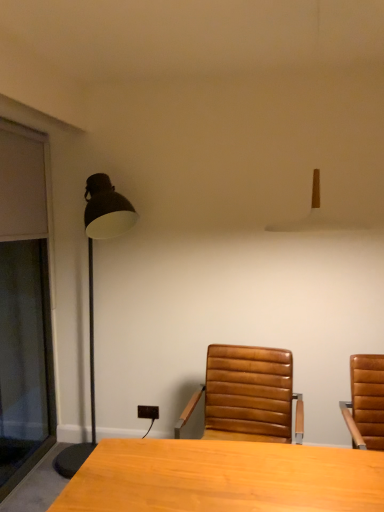
Question: Considering the relative sizes of leather at center and transparent glass screen door at left in the image provided, is leather at center smaller than transparent glass screen door at left?

Choices:
 (A) no
 (B) yes

Answer: (A)

Question: Is leather at center to the left of transparent glass screen door at left from the viewer's perspective?

Choices:
 (A) no
 (B) yes

Answer: (A)

Question: Is leather at center at the right side of transparent glass screen door at left?

Choices:
 (A) yes
 (B) no

Answer: (A)

Question: Is leather at center behind transparent glass screen door at left?

Choices:
 (A) yes
 (B) no

Answer: (B)

Question: Is leather at center closer to camera compared to transparent glass screen door at left?

Choices:
 (A) no
 (B) yes

Answer: (B)

Question: Considering the positions of point (39, 187) and point (91, 258), is point (39, 187) closer or farther from the camera than point (91, 258)?

Choices:
 (A) closer
 (B) farther

Answer: (A)

Question: Is transparent glass screen door at left wider or thinner than matte black floor lamp at left, acting as the 2th lamp starting from the front?

Choices:
 (A) thin
 (B) wide

Answer: (A)

Question: Considering the positions of transparent glass screen door at left and matte black floor lamp at left, which is counted as the 2th lamp, starting from the right, in the image, is transparent glass screen door at left bigger or smaller than matte black floor lamp at left, which is counted as the 2th lamp, starting from the right,?

Choices:
 (A) small
 (B) big

Answer: (A)

Question: From a real-world perspective, is transparent glass screen door at left above or below matte black floor lamp at left, which is the 1th lamp in left-to-right order?

Choices:
 (A) below
 (B) above

Answer: (B)

Question: Considering the positions of matte black floor lamp at left, which is the 1th lamp in left-to-right order, and white matte lampshade at upper center, the 2th lamp in the back-to-front sequence, in the image, is matte black floor lamp at left, which is the 1th lamp in left-to-right order, bigger or smaller than white matte lampshade at upper center, the 2th lamp in the back-to-front sequence,?

Choices:
 (A) small
 (B) big

Answer: (B)

Question: From the image's perspective, is matte black floor lamp at left, arranged as the first lamp when viewed from the back, positioned above or below white matte lampshade at upper center, which ranks as the first lamp in right-to-left order?

Choices:
 (A) above
 (B) below

Answer: (B)

Question: Choose the correct answer: Is matte black floor lamp at left, which is counted as the 2th lamp, starting from the right, inside white matte lampshade at upper center, acting as the second lamp starting from the left, or outside it?

Choices:
 (A) inside
 (B) outside

Answer: (B)

Question: Considering the positions of point (92, 387) and point (314, 183), is point (92, 387) closer or farther from the camera than point (314, 183)?

Choices:
 (A) farther
 (B) closer

Answer: (A)

Question: Based on their positions, is white matte lampshade at upper center, the 2th lamp in the back-to-front sequence, located to the left or right of matte black floor lamp at left, acting as the 2th lamp starting from the front?

Choices:
 (A) left
 (B) right

Answer: (B)

Question: Is white matte lampshade at upper center, the 1th lamp viewed from the front, taller or shorter than matte black floor lamp at left, which is counted as the 2th lamp, starting from the right?

Choices:
 (A) tall
 (B) short

Answer: (B)